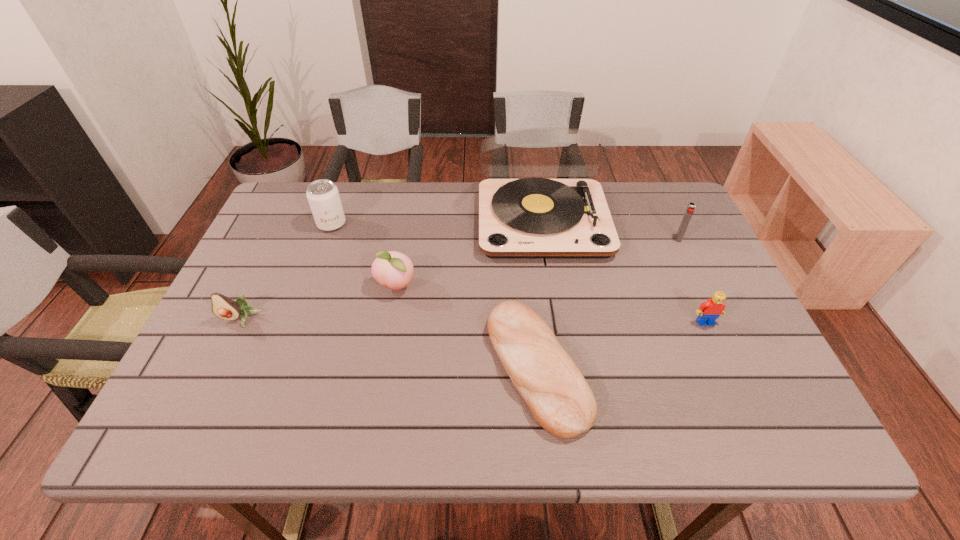
The image size is (960, 540). I want to click on the tallest object, so click(529, 218).

This screenshot has height=540, width=960. I want to click on soda can, so click(323, 196).

Identify the location of igniter. (690, 210).

I want to click on the fifth object from right to left, so click(392, 269).

This screenshot has width=960, height=540. Identify the location of the fourth farthest object. (392, 269).

You are a GUI agent. You are given a task and a screenshot of the screen. Output one action in this format:
    pyautogui.click(x=<x>, y=<y>)
    Task: Click on the Lego
    Image resolution: width=960 pixels, height=540 pixels.
    Given the screenshot: What is the action you would take?
    pyautogui.click(x=708, y=312)

Where is `avocado`? The width and height of the screenshot is (960, 540). avocado is located at coordinates (223, 307).

The width and height of the screenshot is (960, 540). I want to click on the shortest object, so click(x=561, y=401).

The width and height of the screenshot is (960, 540). I want to click on blank area located 0.280m with the tonearm facing the front of the tallest object, so click(x=563, y=350).

Where is `free spot located on the front of the second object from left to right`? The width and height of the screenshot is (960, 540). free spot located on the front of the second object from left to right is located at coordinates (307, 290).